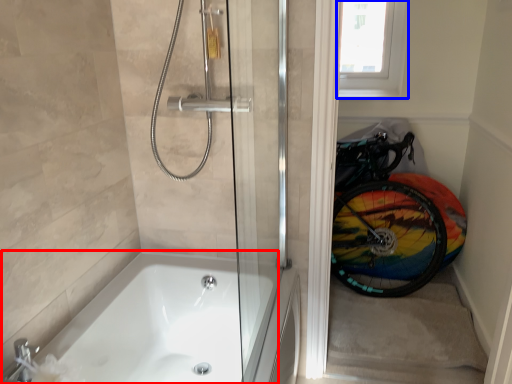
Question: Which of the following is the farthest to the observer, bathtub (highlighted by a red box) or window screen (highlighted by a blue box)?

Choices:
 (A) bathtub
 (B) window screen

Answer: (B)